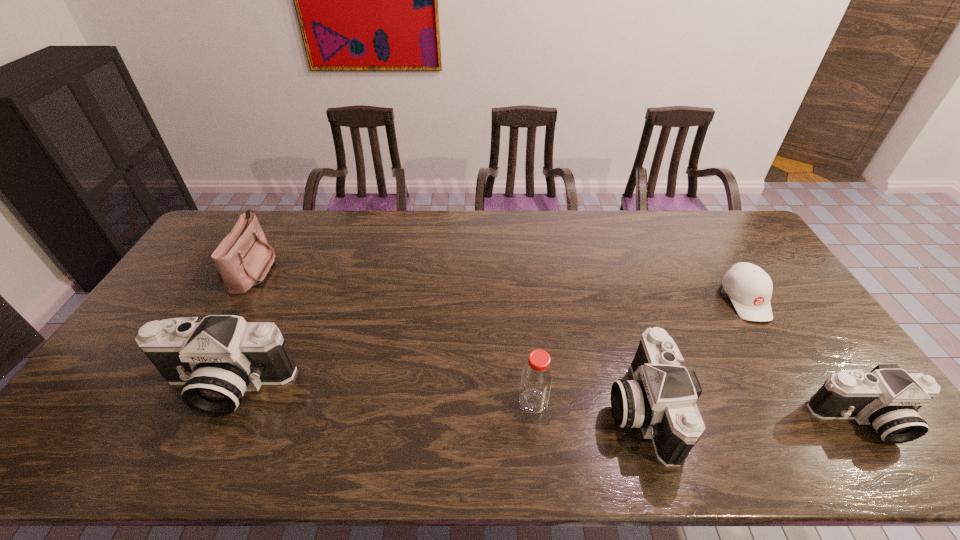
Image resolution: width=960 pixels, height=540 pixels. I want to click on vacant area that satisfies the following two spatial constraints: 1. on the front side of the leftmost camera; 2. on the right side of the rightmost camera, so click(x=208, y=420).

You are a GUI agent. You are given a task and a screenshot of the screen. Output one action in this format:
    pyautogui.click(x=<x>, y=<y>)
    Task: Click on the blank space that satisfies the following two spatial constraints: 1. on the front pocket of the shoulder bag; 2. on the right side of the fourth object from right to left
    The width and height of the screenshot is (960, 540).
    Given the screenshot: What is the action you would take?
    pyautogui.click(x=180, y=402)

I want to click on free space that satisfies the following two spatial constraints: 1. on the front pocket of the shoulder bag; 2. on the left side of the bottle, so click(180, 402).

Where is `free location that satisfies the following two spatial constraints: 1. on the front pocket of the shoulder bag; 2. on the left side of the leftmost camera`? This screenshot has width=960, height=540. free location that satisfies the following two spatial constraints: 1. on the front pocket of the shoulder bag; 2. on the left side of the leftmost camera is located at coordinates (188, 386).

Locate an element on the screen. The image size is (960, 540). free point that satisfies the following two spatial constraints: 1. on the front pocket of the shoulder bag; 2. on the left side of the third object from right to left is located at coordinates (176, 408).